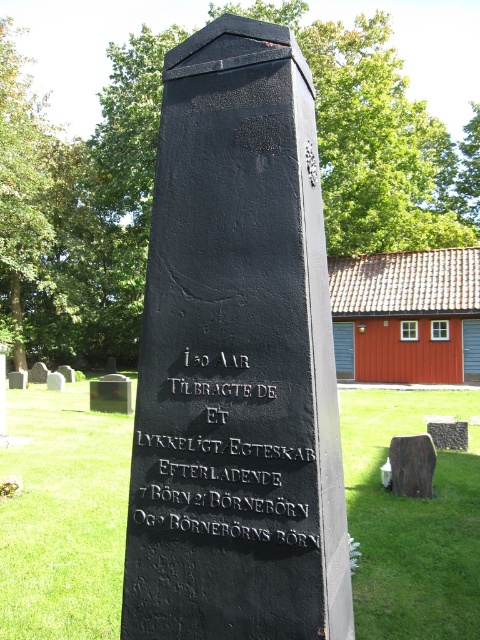
What is the relationship between the sizes of the black stone plaque at center and the brown wood at center on the monument?

The black stone plaque at center has a smaller size compared to the brown wood at center.

What is the spatial relationship between the black stone plaque at center and the brown wood at center?

The black stone plaque at center is above the brown wood at center.